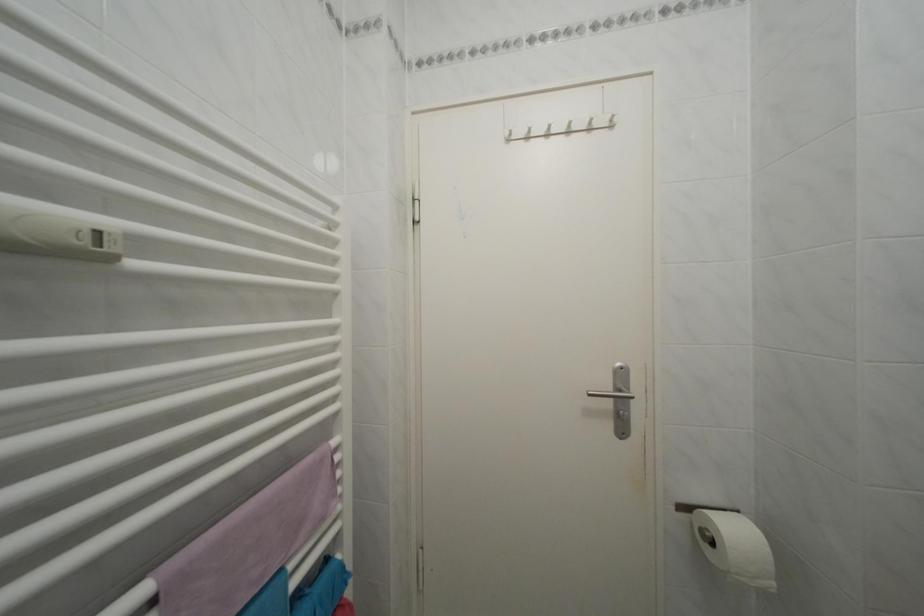
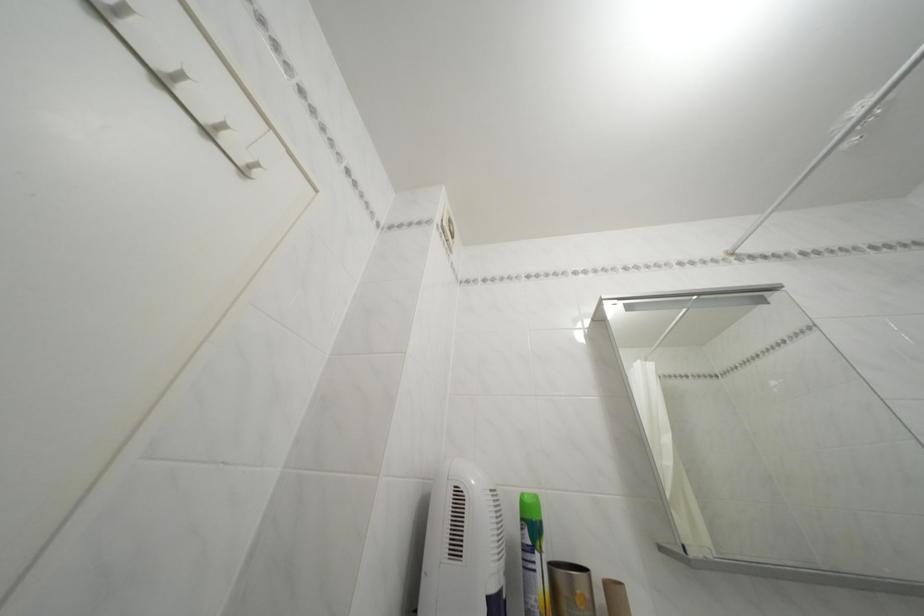
How did the camera likely rotate?

The camera rotated toward right-up.